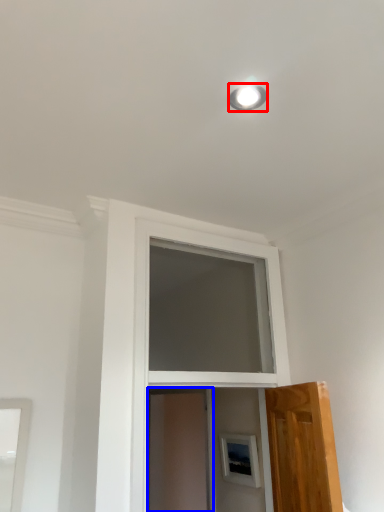
Question: Which object is further to the camera taking this photo, lighting (highlighted by a red box) or screen door (highlighted by a blue box)?

Choices:
 (A) lighting
 (B) screen door

Answer: (B)